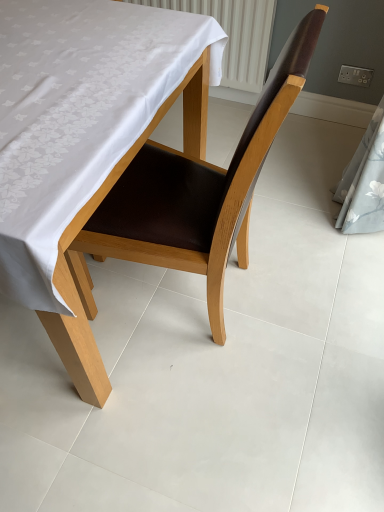
Find the location of a particular element. The width and height of the screenshot is (384, 512). brown leather chair at center is located at coordinates (198, 189).

This screenshot has height=512, width=384. What do you see at coordinates (198, 189) in the screenshot? I see `brown leather chair at center` at bounding box center [198, 189].

Image resolution: width=384 pixels, height=512 pixels. What do you see at coordinates (84, 142) in the screenshot?
I see `white fabric-covered table at center` at bounding box center [84, 142].

This screenshot has width=384, height=512. What are the coordinates of `white fabric-covered table at center` in the screenshot? It's located at (84, 142).

What is the approximate width of white fabric-covered table at center?

It is 1.04 meters.

Image resolution: width=384 pixels, height=512 pixels. Identify the location of brown leather chair at center. (198, 189).

Is white fabric-covered table at center to the left of brown leather chair at center from the viewer's perspective?

Correct, you'll find white fabric-covered table at center to the left of brown leather chair at center.

Does white fabric-covered table at center lie behind brown leather chair at center?

That is False.

Does point (15, 58) come closer to viewer compared to point (184, 257)?

Yes, it is.

From the image's perspective, which one is positioned higher, white fabric-covered table at center or brown leather chair at center?

white fabric-covered table at center, from the image's perspective.

From a real-world perspective, is white fabric-covered table at center physically above brown leather chair at center?

No, from a real-world perspective, white fabric-covered table at center is not above brown leather chair at center.

Looking at their sizes, would you say white fabric-covered table at center is wider or thinner than brown leather chair at center?

white fabric-covered table at center is wider than brown leather chair at center.

Which of these two, white fabric-covered table at center or brown leather chair at center, stands taller?

brown leather chair at center.

Does white fabric-covered table at center have a smaller size compared to brown leather chair at center?

No.

Is white fabric-covered table at center inside the boundaries of brown leather chair at center, or outside?

white fabric-covered table at center is spatially situated outside brown leather chair at center.

Are white fabric-covered table at center and brown leather chair at center far apart?

No, there isn't a large distance between white fabric-covered table at center and brown leather chair at center.

Is white fabric-covered table at center oriented towards brown leather chair at center?

No.

How much distance is there between white fabric-covered table at center and brown leather chair at center?

white fabric-covered table at center and brown leather chair at center are 10.79 inches apart from each other.

The height and width of the screenshot is (512, 384). Find the location of `chair that appears below the white fabric-covered table at center (from the image's perspective)`. chair that appears below the white fabric-covered table at center (from the image's perspective) is located at coordinates (198, 189).

Which is more to the left, brown leather chair at center or white fabric-covered table at center?

white fabric-covered table at center.

Which object is closer to the camera taking this photo, brown leather chair at center or white fabric-covered table at center?

white fabric-covered table at center.

Between point (234, 234) and point (32, 76), which one is positioned in front?

The point (32, 76) is closer.

From the image's perspective, is brown leather chair at center on top of white fabric-covered table at center?

No.

From a real-world perspective, is brown leather chair at center over white fabric-covered table at center?

Correct, in the physical world, brown leather chair at center is higher than white fabric-covered table at center.

From the picture: Looking at their sizes, would you say brown leather chair at center is wider or thinner than white fabric-covered table at center?

Considering their sizes, brown leather chair at center looks slimmer than white fabric-covered table at center.

Based on the photo, can you confirm if brown leather chair at center is taller than white fabric-covered table at center?

Yes, brown leather chair at center is taller than white fabric-covered table at center.

Between brown leather chair at center and white fabric-covered table at center, which one has smaller size?

Smaller between the two is brown leather chair at center.

Is brown leather chair at center spatially inside white fabric-covered table at center, or outside of it?

brown leather chair at center is contained in white fabric-covered table at center.

Is brown leather chair at center next to white fabric-covered table at center?

brown leather chair at center and white fabric-covered table at center are not in contact.

Is brown leather chair at center aimed at white fabric-covered table at center?

Yes, brown leather chair at center is oriented towards white fabric-covered table at center.

How many degrees apart are the facing directions of brown leather chair at center and white fabric-covered table at center?

The facing directions of brown leather chair at center and white fabric-covered table at center are 87.1 degrees apart.

Locate an element on the screen. This screenshot has width=384, height=512. table located on the left of brown leather chair at center is located at coordinates (84, 142).

Locate an element on the screen. table that appears on the left of brown leather chair at center is located at coordinates (84, 142).

At what (x,y) coordinates should I click in order to perform the action: click on chair behind the white fabric-covered table at center. Please return your answer as a coordinate pair (x, y). This screenshot has width=384, height=512. Looking at the image, I should click on (198, 189).